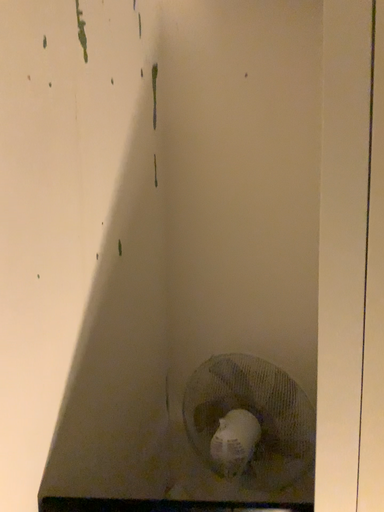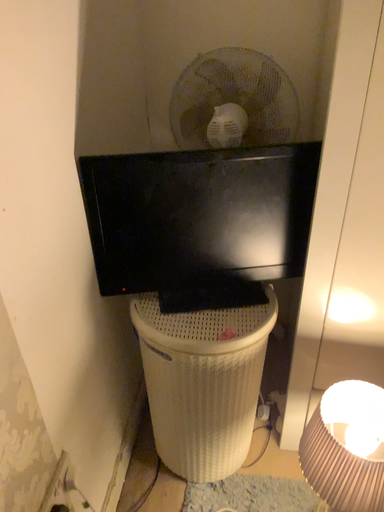
Question: How did the camera likely rotate when shooting the video?

Choices:
 (A) rotated left
 (B) rotated right

Answer: (B)